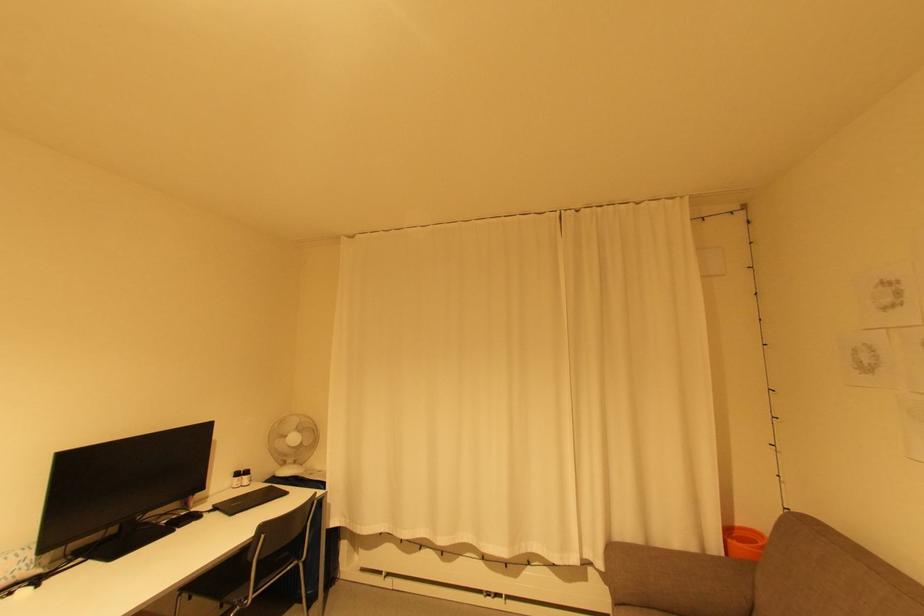
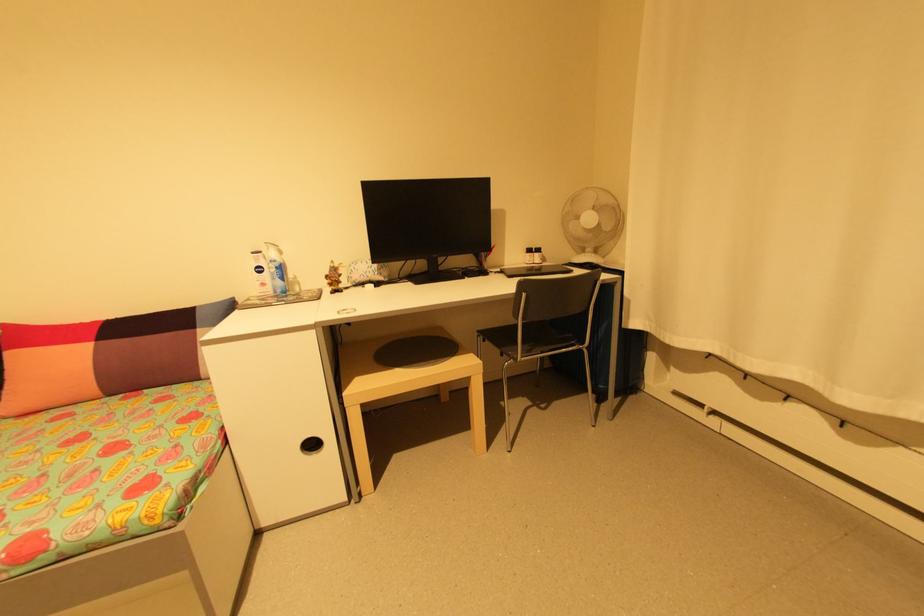
Where in the second image is the point corresponding to (93,562) from the first image?

(414, 283)